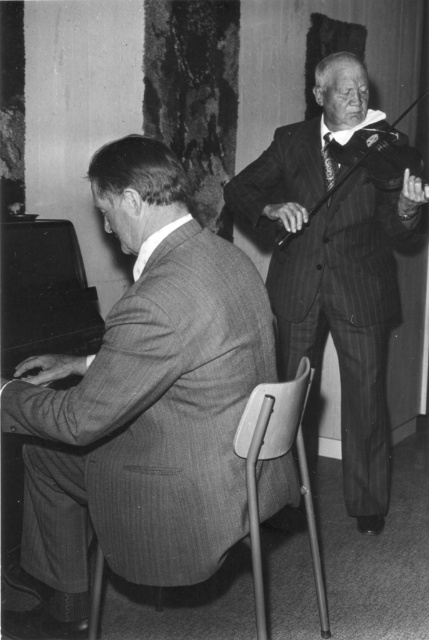
Is point (208, 262) positioned in front of point (314, 212)?

Yes, point (208, 262) is in front of point (314, 212).

Measure the distance between striped suit at left and wooden violin at upper right.

They are 1.15 meters apart.

This screenshot has width=429, height=640. Identify the location of striped suit at left. (141, 404).

In the scene shown: Is pinstriped suit at right to the right of metallic gray chair at center from the viewer's perspective?

Indeed, pinstriped suit at right is positioned on the right side of metallic gray chair at center.

Is pinstriped suit at right to the left of metallic gray chair at center from the viewer's perspective?

In fact, pinstriped suit at right is to the right of metallic gray chair at center.

Who is more forward, [359,228] or [304,452]?

Point [304,452] is in front.

Locate an element on the screen. The image size is (429, 640). pinstriped suit at right is located at coordinates (335, 268).

Between pinstriped suit at right and wooden violin at upper right, which one has more height?

With more height is pinstriped suit at right.

Find the location of `pinstriped suit at right`. pinstriped suit at right is located at coordinates (335, 268).